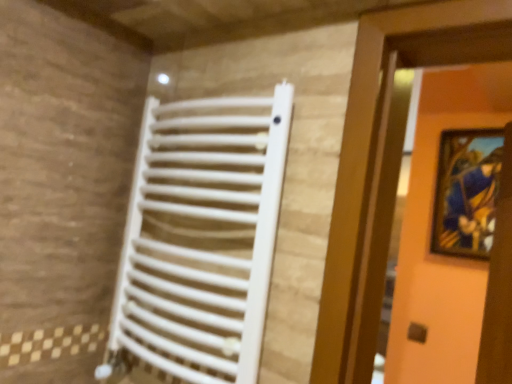
Question: Is matte wooden picture frame at upper right situated inside white matte radiator at center or outside?

Choices:
 (A) outside
 (B) inside

Answer: (A)

Question: From the image's perspective, is matte wooden picture frame at upper right located above or below white matte radiator at center?

Choices:
 (A) below
 (B) above

Answer: (B)

Question: Relative to white matte radiator at center, is matte wooden picture frame at upper right in front or behind?

Choices:
 (A) front
 (B) behind

Answer: (B)

Question: From their relative heights in the image, would you say white matte radiator at center is taller or shorter than matte wooden picture frame at upper right?

Choices:
 (A) tall
 (B) short

Answer: (A)

Question: Is point (170, 173) closer or farther from the camera than point (487, 196)?

Choices:
 (A) closer
 (B) farther

Answer: (A)

Question: In the image, is white matte radiator at center positioned in front of or behind matte wooden picture frame at upper right?

Choices:
 (A) front
 (B) behind

Answer: (A)

Question: Visually, is white matte radiator at center positioned to the left or to the right of matte wooden picture frame at upper right?

Choices:
 (A) right
 (B) left

Answer: (B)